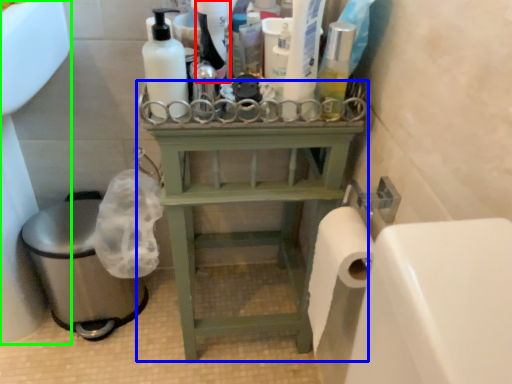
Question: Which object is the farthest from cleaning product (highlighted by a red box)? Choose among these: furniture (highlighted by a blue box) or sink (highlighted by a green box).

Choices:
 (A) furniture
 (B) sink

Answer: (B)